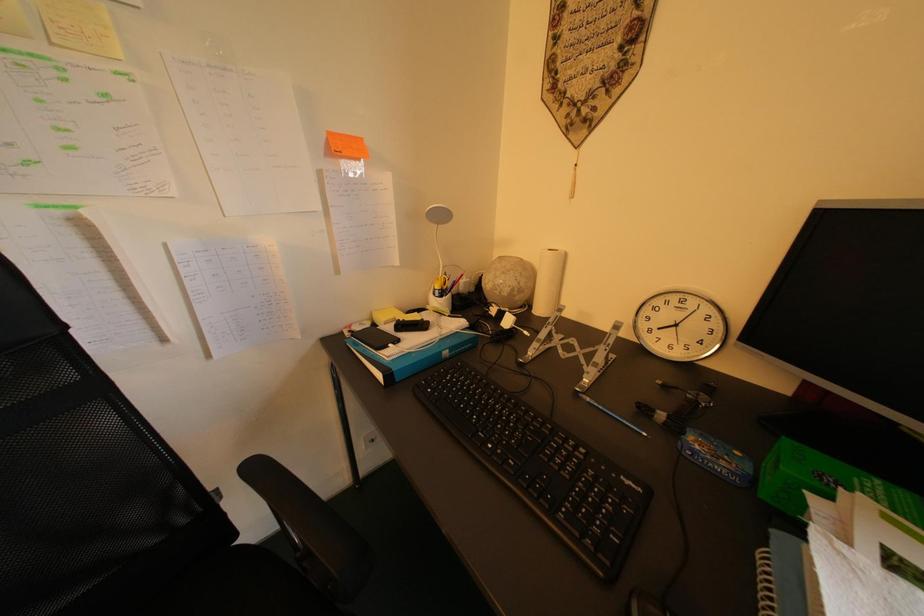
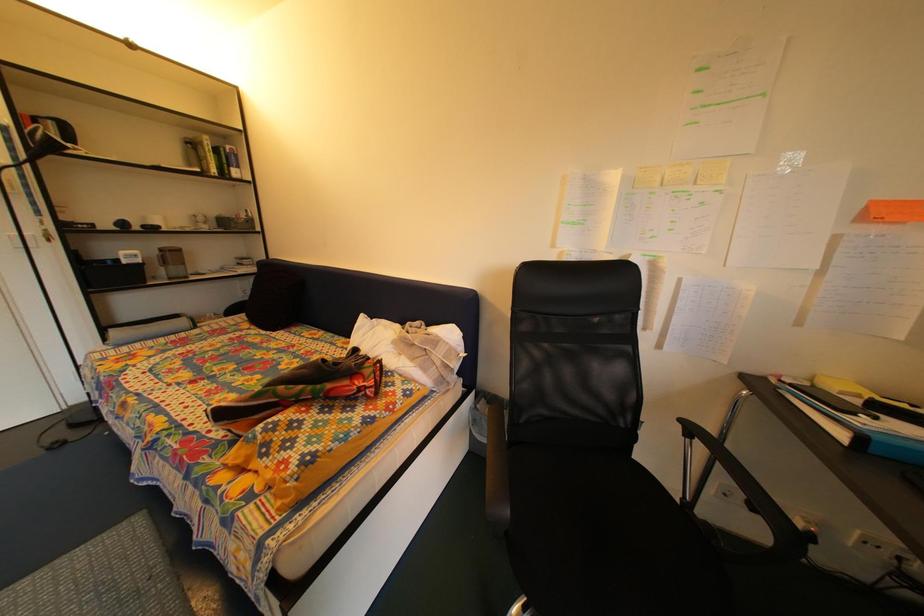
Question: Based on the continuous images, in which direction is the camera rotating? Reply with the corresponding letter.

Choices:
 (A) Left
 (B) Right
 (C) Up
 (D) Down

Answer: (A)